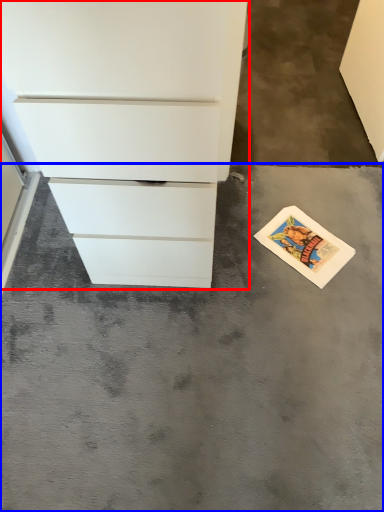
Question: Which object is closer to the camera taking this photo, chest of drawers (highlighted by a red box) or concrete (highlighted by a blue box)?

Choices:
 (A) chest of drawers
 (B) concrete

Answer: (A)